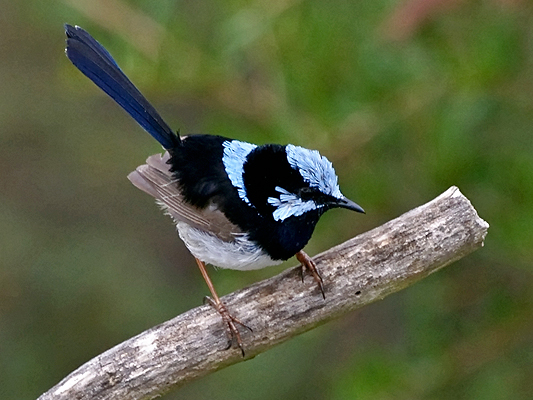
Where is `chest`? chest is located at coordinates (268, 245).